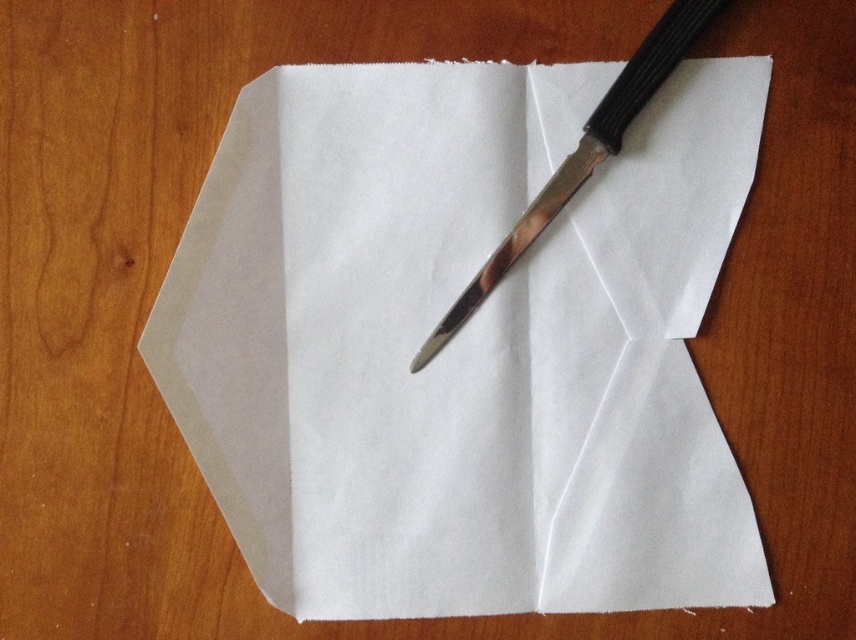
Question: Among these points, which one is farthest from the camera?

Choices:
 (A) pos(346,563)
 (B) pos(706,12)

Answer: (A)

Question: Is white matte paper at center to the right of polished metal knife at center from the viewer's perspective?

Choices:
 (A) yes
 (B) no

Answer: (B)

Question: Considering the relative positions of white matte paper at center and polished metal knife at center in the image provided, where is white matte paper at center located with respect to polished metal knife at center?

Choices:
 (A) right
 (B) left

Answer: (B)

Question: Is white matte paper at center below polished metal knife at center?

Choices:
 (A) no
 (B) yes

Answer: (B)